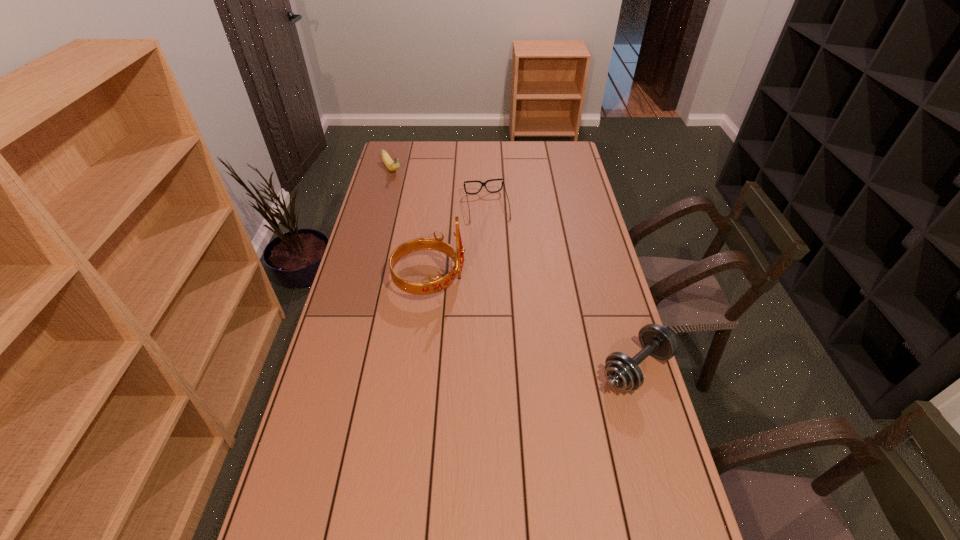
This screenshot has height=540, width=960. Find the location of `vacant space on the desktop that is between the tiara and the dumbbell and is positioned at the stem of the leftmost object`. vacant space on the desktop that is between the tiara and the dumbbell and is positioned at the stem of the leftmost object is located at coordinates (507, 312).

Where is `vacant space on the desktop that is between the tiara and the nearest object and is positioned with the lenses facing outward on the spectacles`? vacant space on the desktop that is between the tiara and the nearest object and is positioned with the lenses facing outward on the spectacles is located at coordinates (513, 315).